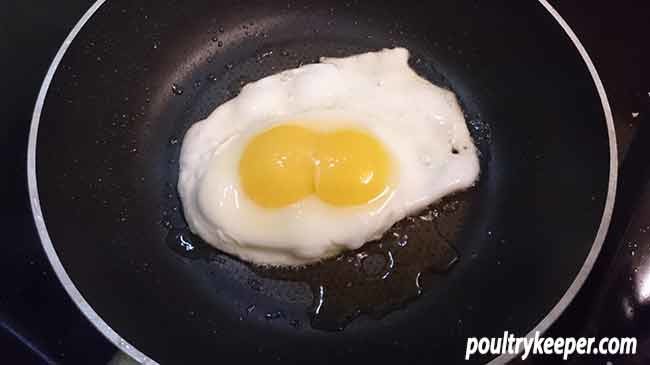
In order to click on cooking pan in this screenshot , I will do `click(183, 64)`.